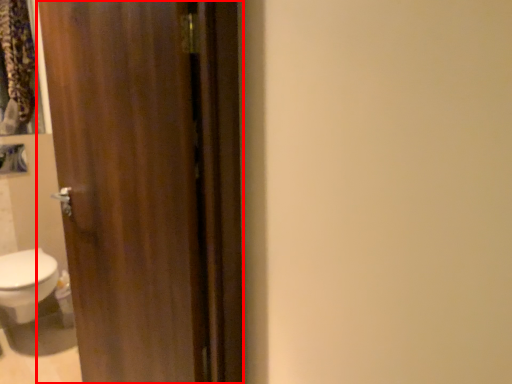
Question: From the image's perspective, where is door (annotated by the red box) located relative to bidet?

Choices:
 (A) above
 (B) below

Answer: (A)